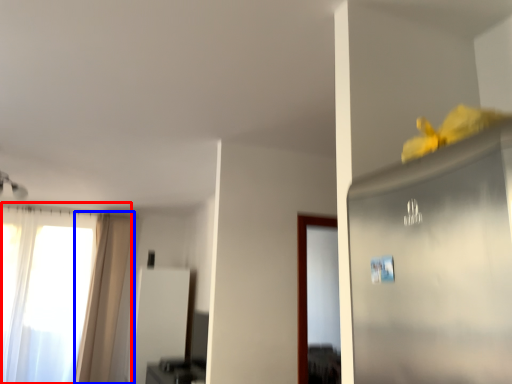
Question: Which object is further to the camera taking this photo, window (highlighted by a red box) or curtain (highlighted by a blue box)?

Choices:
 (A) window
 (B) curtain

Answer: (B)